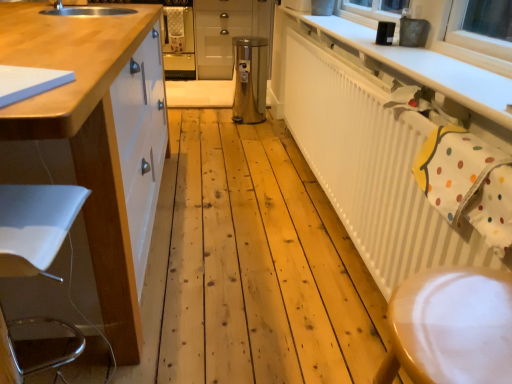
The height and width of the screenshot is (384, 512). Find the location of `free region on the left part of white textured radiator at upper right`. free region on the left part of white textured radiator at upper right is located at coordinates (238, 207).